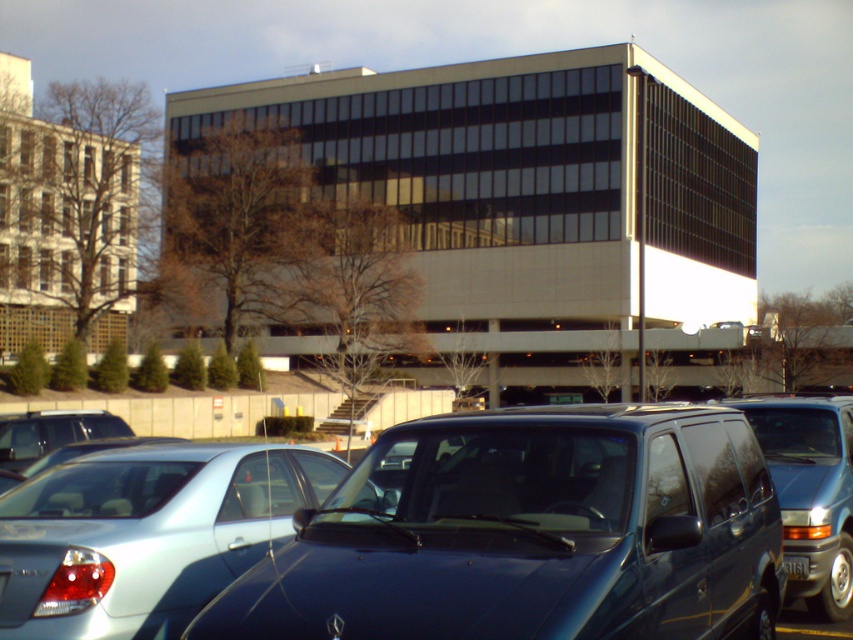
Measure the distance between point (x=213, y=451) and camera.

They are 7.15 meters apart.

Is satin silver sedan at center positioned before silver metallic sedan at center?

Yes, satin silver sedan at center is in front of silver metallic sedan at center.

Where is `satin silver sedan at center`? The height and width of the screenshot is (640, 853). satin silver sedan at center is located at coordinates (146, 534).

Find the location of a particular element. Image resolution: width=853 pixels, height=640 pixels. satin silver sedan at center is located at coordinates (146, 534).

Is satin silver sedan at center wider than matte blue van at center?

Correct, the width of satin silver sedan at center exceeds that of matte blue van at center.

Where is `satin silver sedan at center`? satin silver sedan at center is located at coordinates (146, 534).

I want to click on satin silver sedan at center, so click(x=146, y=534).

Does glossy dark blue van at center appear on the right side of matte blue van at center?

No, glossy dark blue van at center is not to the right of matte blue van at center.

Who is shorter, glossy dark blue van at center or matte blue van at center?

Standing shorter between the two is glossy dark blue van at center.

I want to click on glossy dark blue van at center, so click(529, 532).